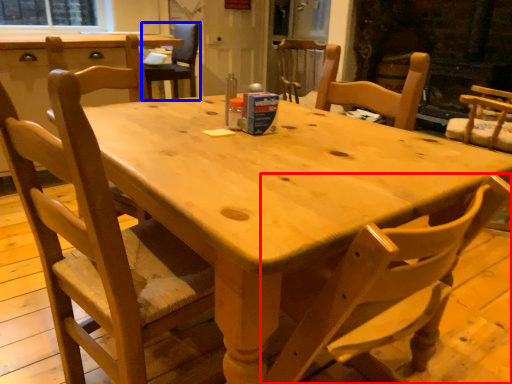
Question: Which point is closer to the camera, chair (highlighted by a red box) or chair (highlighted by a blue box)?

Choices:
 (A) chair
 (B) chair

Answer: (A)